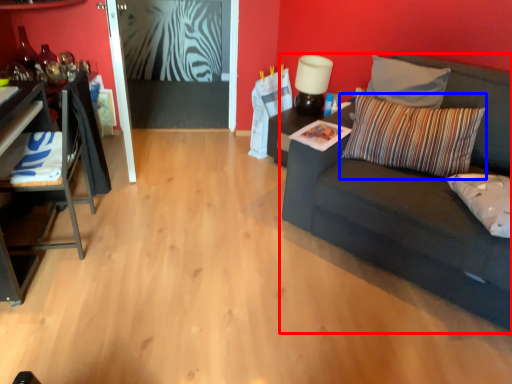
Question: Which of the following is the closest to the observer, studio couch (highlighted by a red box) or pillow (highlighted by a blue box)?

Choices:
 (A) studio couch
 (B) pillow

Answer: (A)